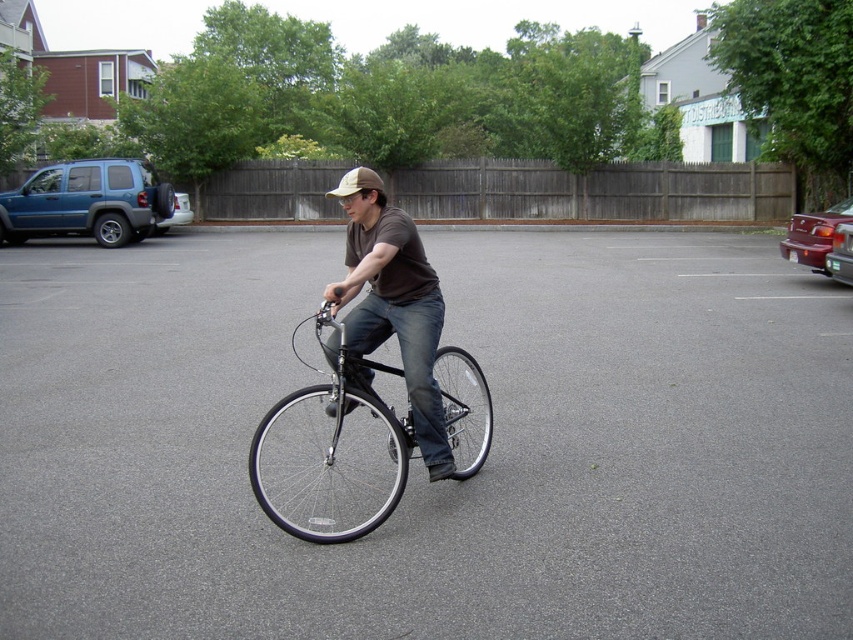
Question: Which point appears farthest from the camera in this image?

Choices:
 (A) (39, 179)
 (B) (426, 332)
 (C) (383, 193)

Answer: (A)

Question: Can you confirm if gray asphalt parking lot at center is bigger than brown fabric baseball hat at center?

Choices:
 (A) no
 (B) yes

Answer: (A)

Question: Which of the following is the farthest from the observer?

Choices:
 (A) matte brown shirt at center
 (B) shiny black bicycle at center

Answer: (A)

Question: Can you confirm if gray asphalt parking lot at center is positioned below matte blue suv at left?

Choices:
 (A) no
 (B) yes

Answer: (B)

Question: Which point is closer to the camera?

Choices:
 (A) brown fabric baseball hat at center
 (B) gray asphalt parking lot at center
 (C) shiny black bicycle at center

Answer: (B)

Question: Can you confirm if gray asphalt parking lot at center is smaller than matte brown shirt at center?

Choices:
 (A) no
 (B) yes

Answer: (A)